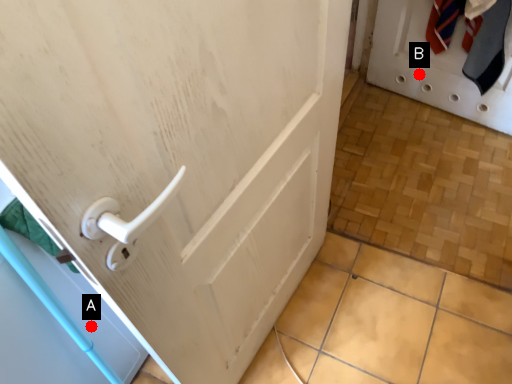
Question: Two points are circled on the image, labeled by A and B beside each circle. Which point appears closest to the camera in this image?

Choices:
 (A) A is closer
 (B) B is closer

Answer: (A)